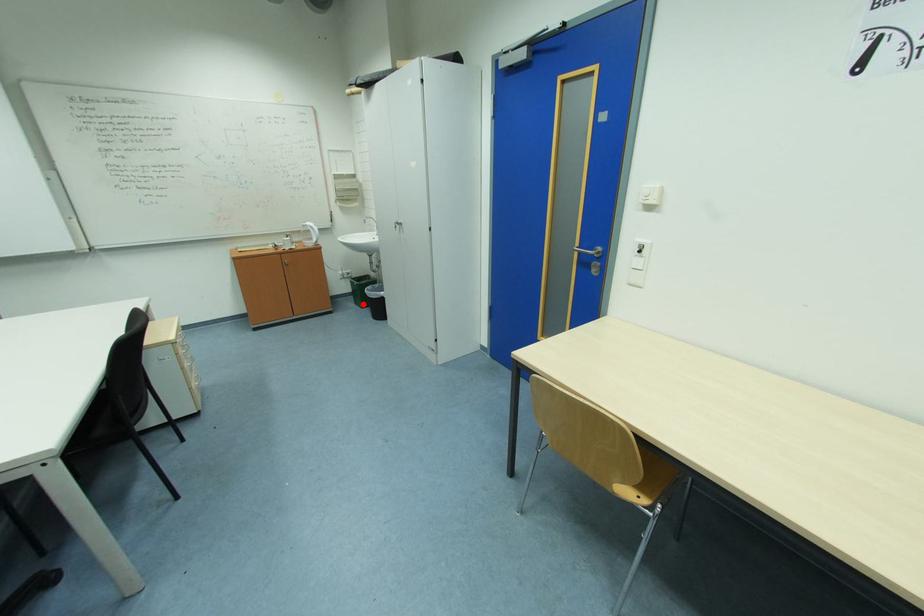
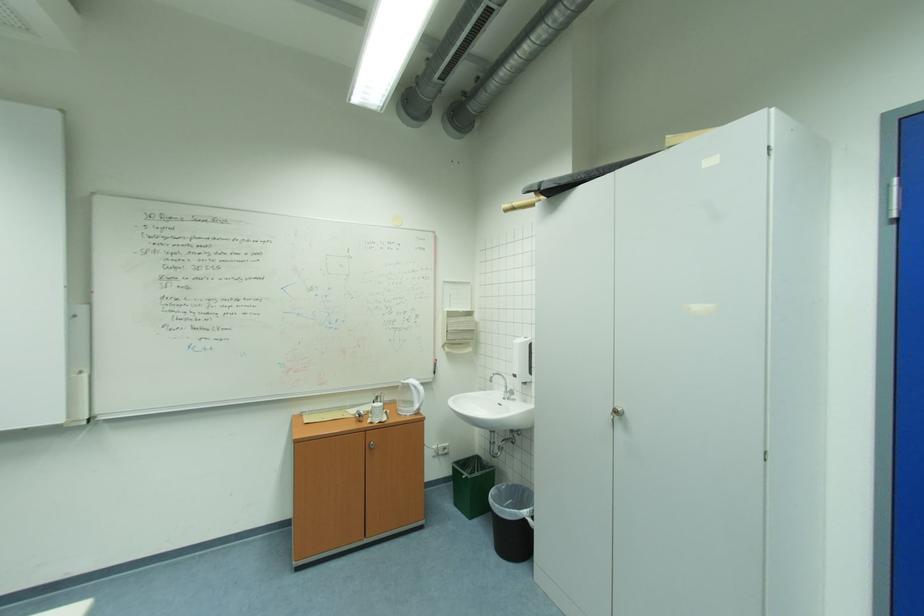
Find the pixel in the second image that matches the highlighted location in the first image.

(464, 505)